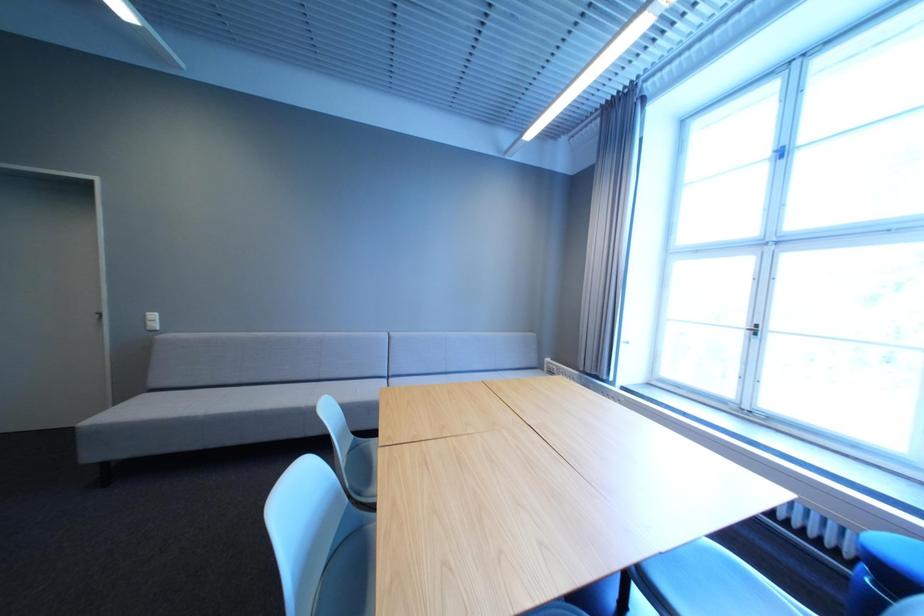
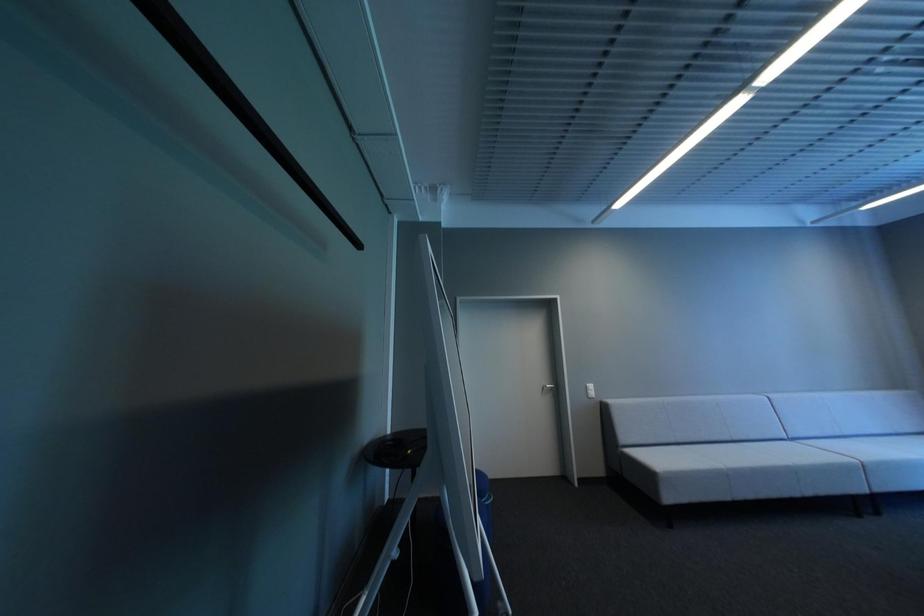
In a continuous first-person perspective shot, in which direction is the camera moving?

The cameraman moved toward left, backward.